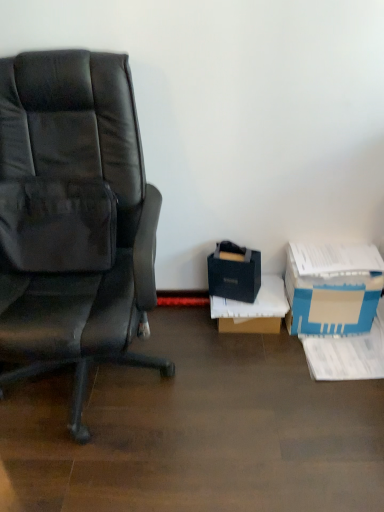
Where is `vacant area that is in front of black matte bag at lower right, the 3th box in the right-to-left sequence`? The image size is (384, 512). vacant area that is in front of black matte bag at lower right, the 3th box in the right-to-left sequence is located at coordinates (238, 307).